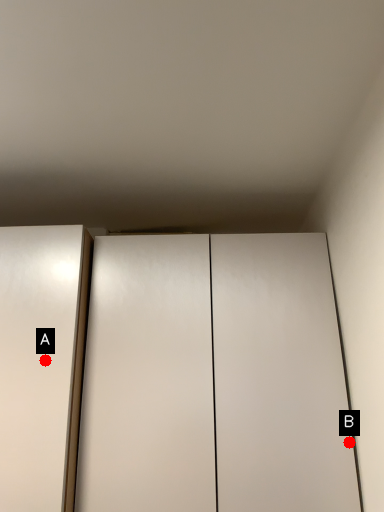
Question: Two points are circled on the image, labeled by A and B beside each circle. Which of the following is the farthest from the observer?

Choices:
 (A) A is further
 (B) B is further

Answer: (A)